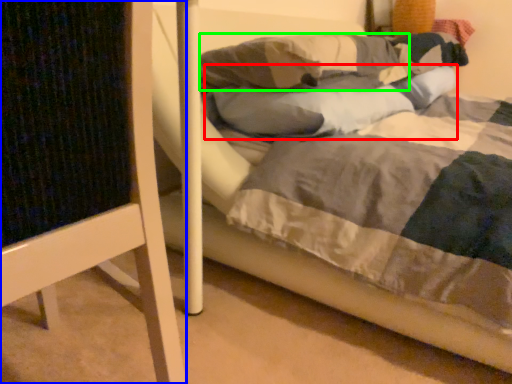
Question: Considering the real-world distances, which object is farthest from pillow (highlighted by a red box)? furniture (highlighted by a blue box) or pillow (highlighted by a green box)?

Choices:
 (A) furniture
 (B) pillow

Answer: (A)